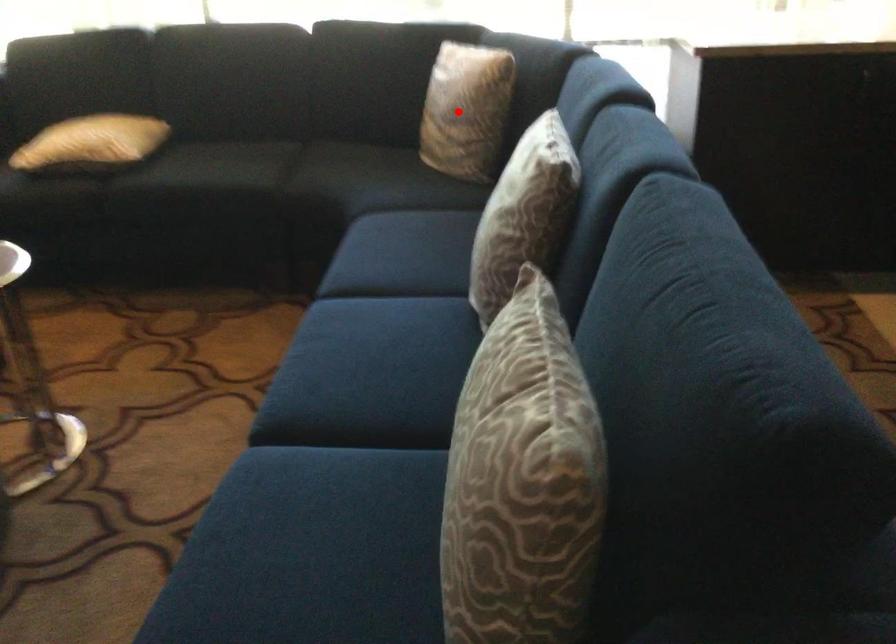
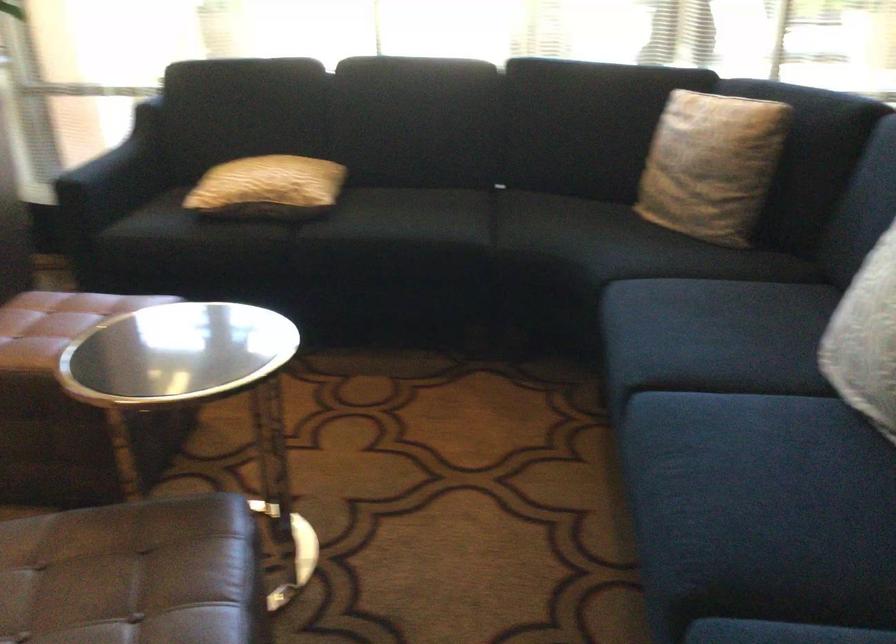
Question: I am providing you with two images of the same scene from different viewpoints. A red point is shown in image1. For the corresponding object point in image2, is it positioned nearer or farther from the camera?

Choices:
 (A) Nearer
 (B) Farther

Answer: (A)